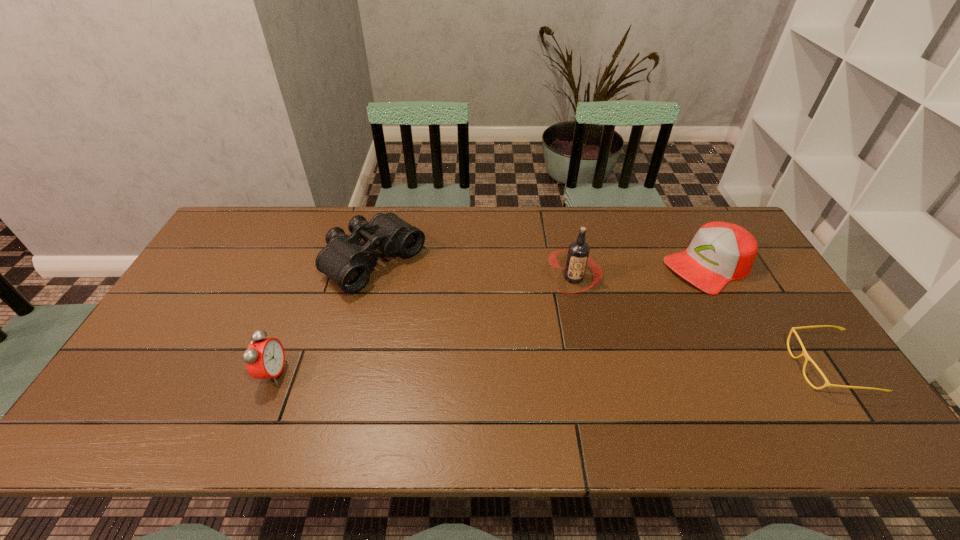
At what (x,y) coordinates should I click in order to perform the action: click on alarm clock. Please return your answer as a coordinate pair (x, y). Image resolution: width=960 pixels, height=540 pixels. Looking at the image, I should click on (264, 358).

This screenshot has height=540, width=960. In order to click on spectacles in this screenshot , I will do `click(807, 358)`.

Locate an element on the screen. This screenshot has height=540, width=960. the tallest object is located at coordinates (578, 252).

The image size is (960, 540). Find the location of `root beer`. root beer is located at coordinates pos(578,252).

This screenshot has height=540, width=960. I want to click on binoculars, so click(344, 260).

The height and width of the screenshot is (540, 960). Find the location of `baseball cap`. baseball cap is located at coordinates (720, 252).

Locate an element on the screen. free region located 0.220m on the front-facing side of the alarm clock is located at coordinates (374, 373).

You are a GUI agent. You are given a task and a screenshot of the screen. Output one action in this format:
    pyautogui.click(x=<x>, y=<y>)
    Task: Click on the vacant space located 0.200m in front of the lenses of the shortest object
    The width and height of the screenshot is (960, 540).
    Given the screenshot: What is the action you would take?
    pyautogui.click(x=716, y=367)

Where is `vacant space located in front of the lenses of the shortest object`? This screenshot has width=960, height=540. vacant space located in front of the lenses of the shortest object is located at coordinates (716, 367).

I want to click on vacant point located in front of the lenses of the shortest object, so click(660, 367).